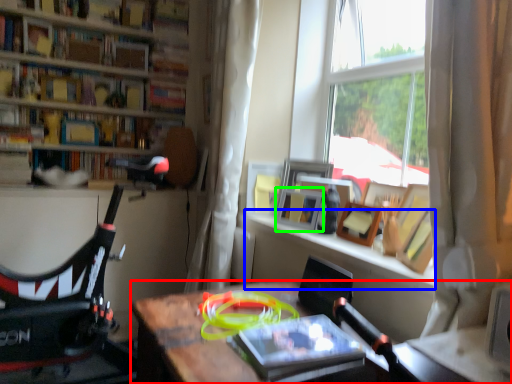
Question: Which is farther away from desk (highlighted by a red box)? window sill (highlighted by a blue box) or picture frame (highlighted by a green box)?

Choices:
 (A) window sill
 (B) picture frame

Answer: (B)